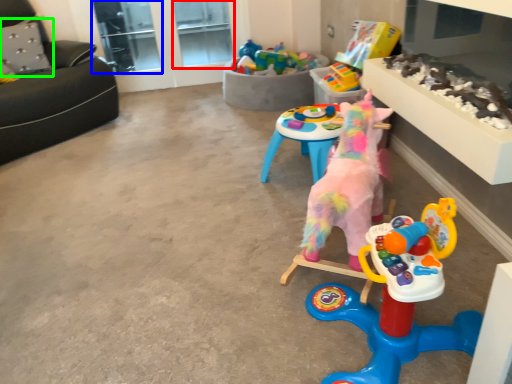
Question: Considering the real-world distances, which object is closest to window screen (highlighted by a red box)? glass door (highlighted by a blue box) or pillow (highlighted by a green box).

Choices:
 (A) glass door
 (B) pillow

Answer: (A)